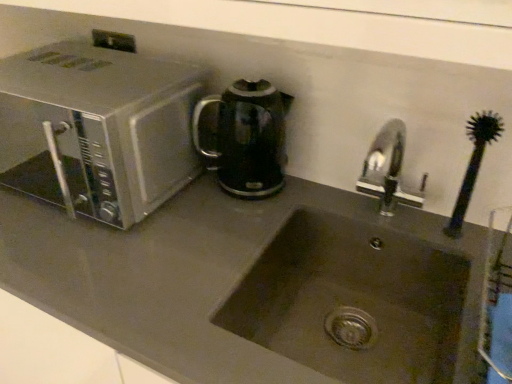
This screenshot has width=512, height=384. Identify the location of vacant space to the right of black glossy electric kettle at center. [311, 192].